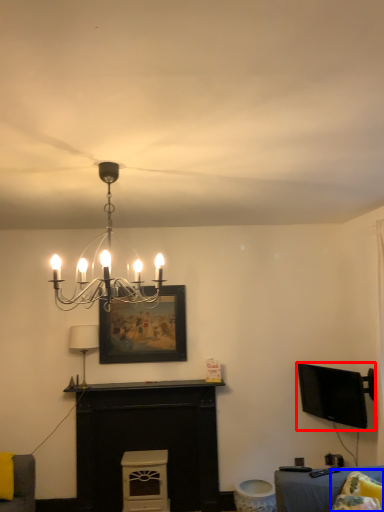
Question: Which object appears closest to the camera in this image, television (highlighted by a red box) or pillow (highlighted by a blue box)?

Choices:
 (A) television
 (B) pillow

Answer: (B)